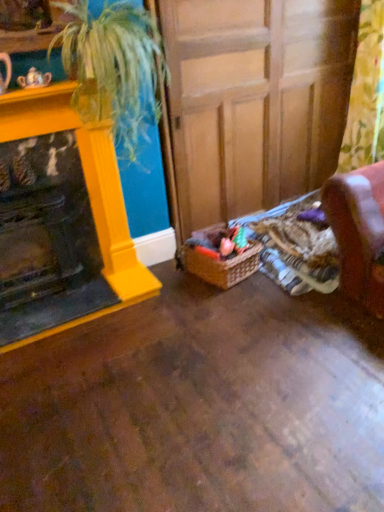
Question: Considering the relative positions of matte yellow fireplace at left and wooden at center in the image provided, is matte yellow fireplace at left to the left or to the right of wooden at center?

Choices:
 (A) left
 (B) right

Answer: (A)

Question: In the image, is matte yellow fireplace at left positioned in front of or behind wooden at center?

Choices:
 (A) front
 (B) behind

Answer: (A)

Question: Estimate the real-world distances between objects in this image. Which object is closer to the matte yellow fireplace at left?

Choices:
 (A) woven brown basket at lower center
 (B) floral fabric curtain at right
 (C) wooden at center
 (D) green leafy plant at upper left

Answer: (D)

Question: Which object is the closest to the wooden at center?

Choices:
 (A) green leafy plant at upper left
 (B) woven brown basket at lower center
 (C) matte yellow fireplace at left
 (D) floral fabric curtain at right

Answer: (A)